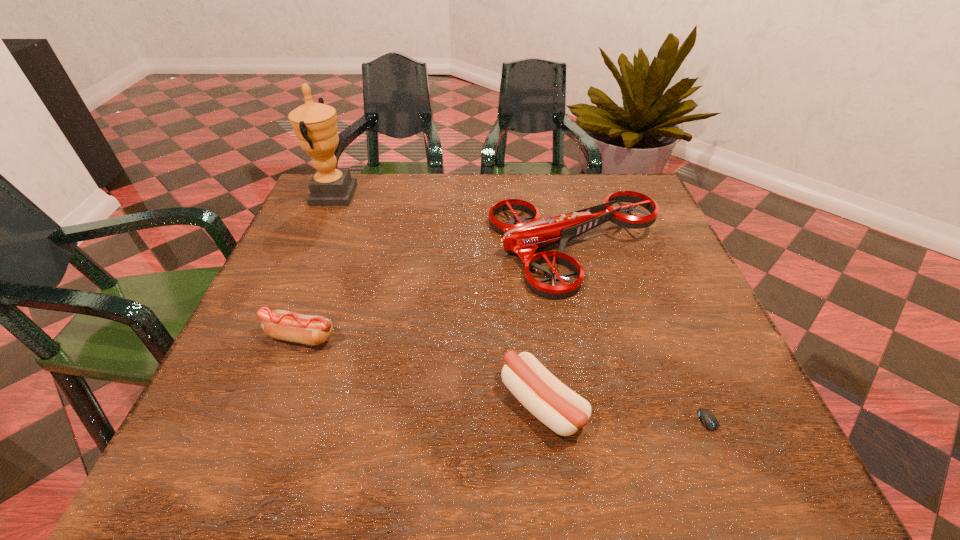
The width and height of the screenshot is (960, 540). Identify the location of free location that satisfies the following two spatial constraints: 1. on the front side of the drone; 2. on the left side of the mouse. (621, 435).

This screenshot has height=540, width=960. What are the coordinates of `blank area in the image that satisfies the following two spatial constraints: 1. at the front of the award with handles; 2. on the back side of the left sausage` in the screenshot? It's located at (270, 337).

Where is `vacant position in the image that satisfies the following two spatial constraints: 1. at the front of the award with handles; 2. on the right side of the right sausage`? This screenshot has width=960, height=540. vacant position in the image that satisfies the following two spatial constraints: 1. at the front of the award with handles; 2. on the right side of the right sausage is located at coordinates (239, 404).

This screenshot has height=540, width=960. I want to click on free spot that satisfies the following two spatial constraints: 1. on the back side of the left sausage; 2. on the left side of the second tallest object, so click(334, 249).

Find the location of a particular element. The width and height of the screenshot is (960, 540). vacant position in the image that satisfies the following two spatial constraints: 1. on the front side of the mouse; 2. on the left side of the right sausage is located at coordinates (546, 435).

Find the location of a particular element. The width and height of the screenshot is (960, 540). vacant space that satisfies the following two spatial constraints: 1. at the front of the mouse with handles; 2. on the right side of the award is located at coordinates (226, 435).

Find the location of a particular element. This screenshot has height=540, width=960. free location that satisfies the following two spatial constraints: 1. at the front of the nearer sausage with handles; 2. on the left side of the award is located at coordinates (239, 404).

Where is `blank space that satisfies the following two spatial constraints: 1. at the front of the third farthest object with handles; 2. on the left side of the tallest object`? The height and width of the screenshot is (540, 960). blank space that satisfies the following two spatial constraints: 1. at the front of the third farthest object with handles; 2. on the left side of the tallest object is located at coordinates (270, 337).

Image resolution: width=960 pixels, height=540 pixels. Find the location of `vacant area in the image that satisfies the following two spatial constraints: 1. at the front of the tallest object with handles; 2. on the right side of the mouse`. vacant area in the image that satisfies the following two spatial constraints: 1. at the front of the tallest object with handles; 2. on the right side of the mouse is located at coordinates (226, 435).

You are a GUI agent. You are given a task and a screenshot of the screen. Output one action in this format:
    pyautogui.click(x=<x>, y=<y>)
    Task: Click on the vacant space that satisfies the following two spatial constraints: 1. at the front of the tallest object with handles; 2. on the left side of the nearer sausage
    
    Given the screenshot: What is the action you would take?
    pyautogui.click(x=239, y=404)